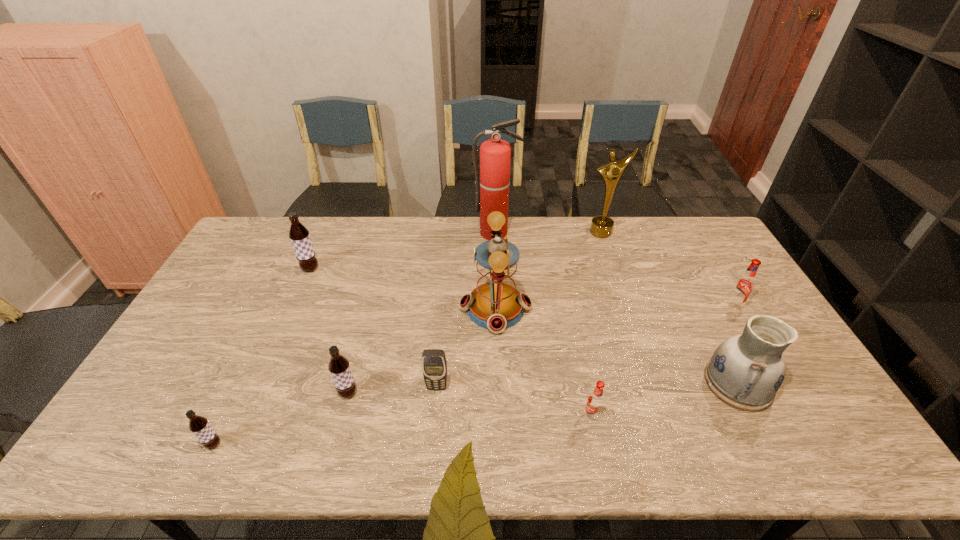
In order to click on object present at the near edge in this screenshot , I will do `click(198, 425)`.

Where is `pottery located in the right edge section of the desktop`? This screenshot has width=960, height=540. pottery located in the right edge section of the desktop is located at coordinates (746, 370).

Where is `root beer that is positioned at the right edge`? The height and width of the screenshot is (540, 960). root beer that is positioned at the right edge is located at coordinates (743, 286).

The width and height of the screenshot is (960, 540). In order to click on vacant space at the far edge of the desktop in this screenshot , I will do `click(381, 221)`.

In the image, there is a desktop. At what (x,y) coordinates should I click in order to perform the action: click on vacant space at the near edge. Please return your answer as a coordinate pair (x, y). The height and width of the screenshot is (540, 960). Looking at the image, I should click on (548, 457).

Image resolution: width=960 pixels, height=540 pixels. Identify the location of free space at the left edge. (192, 337).

In the image, there is a desktop. Identify the location of free space at the right edge. (777, 397).

Identify the location of vacant space at the far right corner of the desktop. (701, 224).

This screenshot has height=540, width=960. I want to click on vacant space that's between the farthest root beer and the eighth object from left to right, so (456, 251).

Identify the location of empty space that is in between the fourth object from left to right and the rightmost root beer. The width and height of the screenshot is (960, 540). (586, 346).